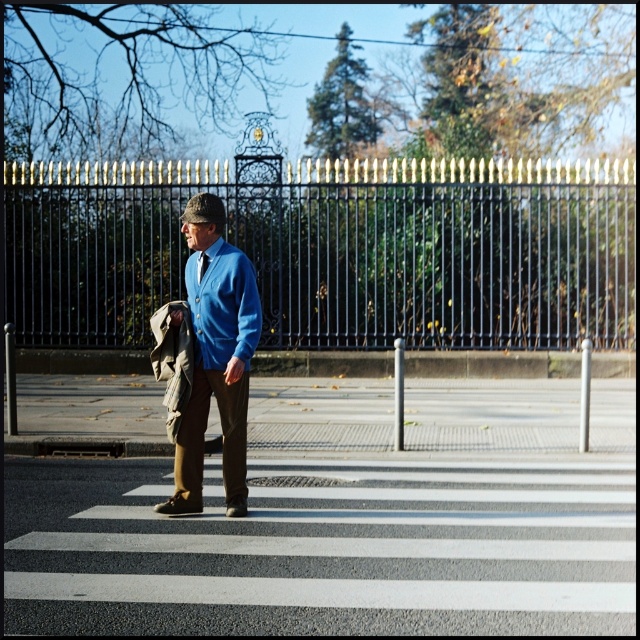
Does blue smooth dress shirt at center have a greater width compared to blue silk tie at center?

Correct, the width of blue smooth dress shirt at center exceeds that of blue silk tie at center.

How distant is blue smooth dress shirt at center from blue silk tie at center?

9.52 inches

Describe the element at coordinates (221, 307) in the screenshot. The width and height of the screenshot is (640, 640). I see `blue smooth dress shirt at center` at that location.

Locate an element on the screen. The width and height of the screenshot is (640, 640). blue smooth dress shirt at center is located at coordinates (221, 307).

Between matte blue sweater at center and blue silk tie at center, which one has less height?

Standing shorter between the two is blue silk tie at center.

Identify the location of matte blue sweater at center. (208, 356).

Find the location of a particular element. matte blue sweater at center is located at coordinates (208, 356).

Between matte blue sweater at center and blue smooth dress shirt at center, which one is positioned lower?

matte blue sweater at center

Is point (189, 394) behind point (246, 355)?

Yes, it is.

Image resolution: width=640 pixels, height=640 pixels. What do you see at coordinates (208, 356) in the screenshot? I see `matte blue sweater at center` at bounding box center [208, 356].

Identify the location of matte blue sweater at center. (208, 356).